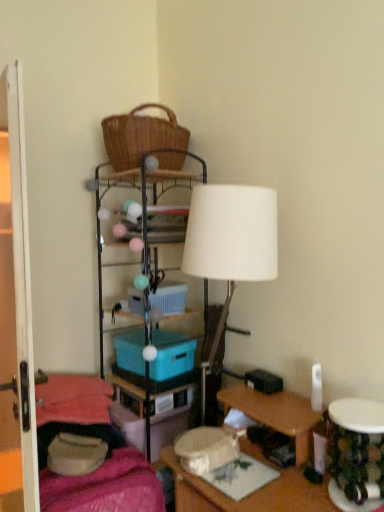
Question: Is metallic wire shelf at center smaller than velvet pink blanket at lower left?

Choices:
 (A) yes
 (B) no

Answer: (B)

Question: From a real-world perspective, does metallic wire shelf at center sit lower than velvet pink blanket at lower left?

Choices:
 (A) yes
 (B) no

Answer: (B)

Question: Can velvet pink blanket at lower left be found inside metallic wire shelf at center?

Choices:
 (A) no
 (B) yes

Answer: (A)

Question: Is metallic wire shelf at center at the left side of velvet pink blanket at lower left?

Choices:
 (A) no
 (B) yes

Answer: (A)

Question: Is metallic wire shelf at center behind velvet pink blanket at lower left?

Choices:
 (A) no
 (B) yes

Answer: (B)

Question: Is metallic wire shelf at center positioned before velvet pink blanket at lower left?

Choices:
 (A) no
 (B) yes

Answer: (A)

Question: Considering the relative sizes of blue plastic storage box at center, the second storage box positioned from the bottom, and white matte lamp at center in the image provided, is blue plastic storage box at center, the second storage box positioned from the bottom, taller than white matte lamp at center?

Choices:
 (A) no
 (B) yes

Answer: (A)

Question: Does blue plastic storage box at center, the second storage box positioned from the bottom, have a greater width compared to white matte lamp at center?

Choices:
 (A) yes
 (B) no

Answer: (B)

Question: Does blue plastic storage box at center, which ranks as the 2th storage box in top-to-bottom order, appear on the right side of white matte lamp at center?

Choices:
 (A) yes
 (B) no

Answer: (B)

Question: Does blue plastic storage box at center, which ranks as the 2th storage box in top-to-bottom order, have a smaller size compared to white matte lamp at center?

Choices:
 (A) no
 (B) yes

Answer: (B)

Question: Considering the relative sizes of blue plastic storage box at center, the second storage box positioned from the bottom, and white matte lamp at center in the image provided, is blue plastic storage box at center, the second storage box positioned from the bottom, bigger than white matte lamp at center?

Choices:
 (A) yes
 (B) no

Answer: (B)

Question: Can you confirm if blue plastic storage box at center, the second storage box positioned from the bottom, is shorter than white matte lamp at center?

Choices:
 (A) yes
 (B) no

Answer: (A)

Question: Is blue plastic storage box at center, arranged as the first storage box when viewed from the top, in contact with velvet pink blanket at lower left?

Choices:
 (A) yes
 (B) no

Answer: (B)